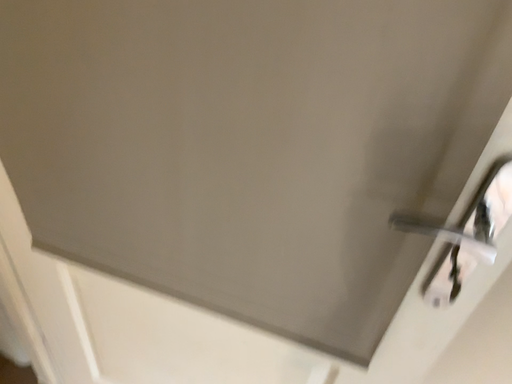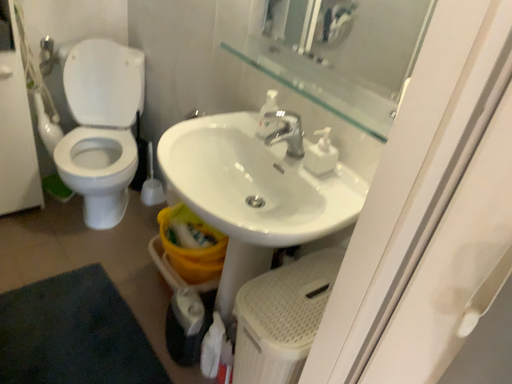
Question: Which way did the camera rotate in the video?

Choices:
 (A) rotated right
 (B) rotated left

Answer: (B)